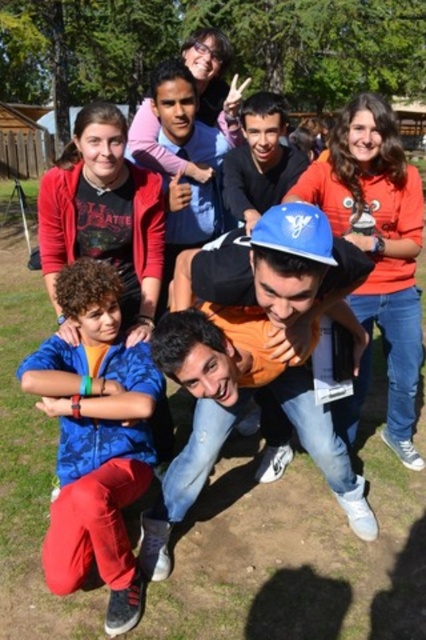
You are organizing a safety inspection and need to ensure that all hard hats meet the minimum width requirement of 25 cm. You observe the blue hard hat at center and the blue fabric shirt at lower left in the image. Which object is wider?

The blue hard hat at center is wider than the blue fabric shirt at lower left, so it meets the minimum width requirement.